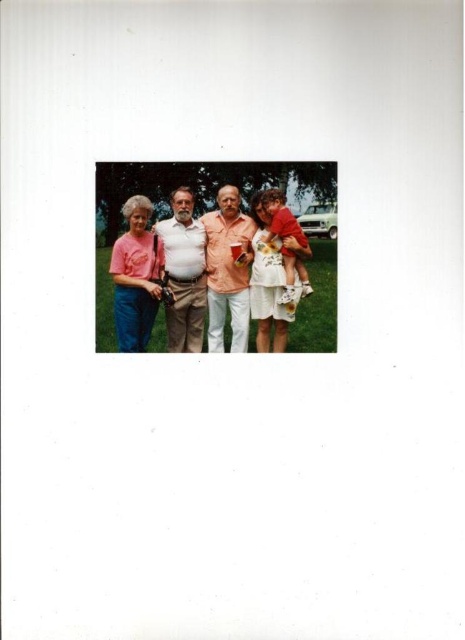
Measure the distance between pink cotton shirt at center and pink t-shirt at left.

A distance of 5.31 inches exists between pink cotton shirt at center and pink t-shirt at left.

Can you confirm if pink cotton shirt at center is bigger than pink t-shirt at left?

Indeed, pink cotton shirt at center has a larger size compared to pink t-shirt at left.

Image resolution: width=465 pixels, height=640 pixels. What do you see at coordinates (187, 266) in the screenshot? I see `pink cotton shirt at center` at bounding box center [187, 266].

At what (x,y) coordinates should I click in order to perform the action: click on pink cotton shirt at center. Please return your answer as a coordinate pair (x, y). The width and height of the screenshot is (465, 640). Looking at the image, I should click on (187, 266).

From the picture: Who is more distant from viewer, (144, 212) or (190, 253)?

The point (190, 253) is behind.

Does pink t-shirt at left have a greater width compared to light brown cotton shirt at center?

Yes.

Between point (117, 298) and point (204, 300), which one is positioned in front?

Point (117, 298)

What are the coordinates of `pink t-shirt at left` in the screenshot? It's located at (135, 276).

Is light brown cotton shirt at center below floral cotton dress at center?

No.

Consider the image. How distant is light brown cotton shirt at center from floral cotton dress at center?

light brown cotton shirt at center and floral cotton dress at center are 40.87 centimeters apart from each other.

Does point (186, 216) lie in front of point (278, 280)?

Yes, point (186, 216) is closer to viewer.

Locate an element on the screen. light brown cotton shirt at center is located at coordinates (184, 273).